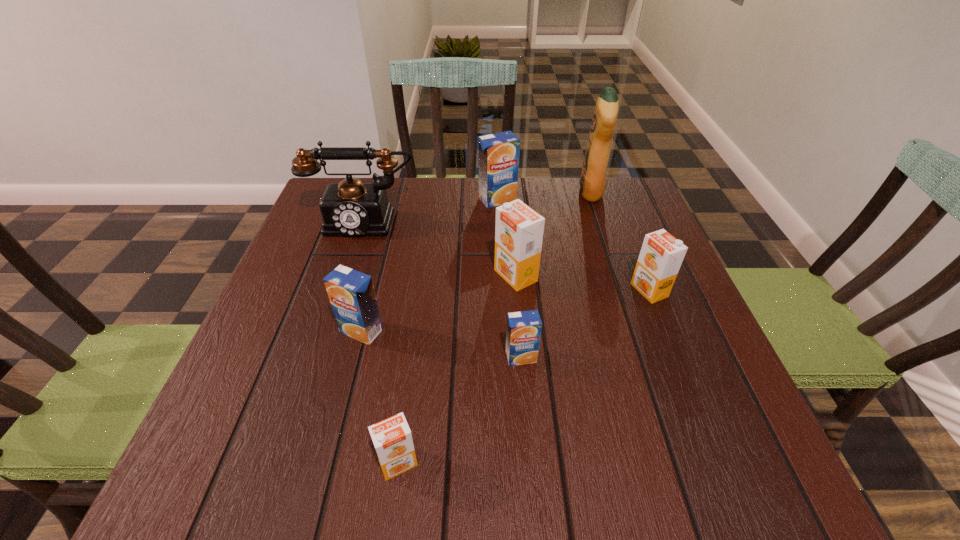
Select which orange juice is the sixth closest to the detergent. Please provide its 2D coordinates. Your answer should be formatted as a tuple, i.e. [(x, y)], where the tuple contains the x and y coordinates of a point satisfying the conditions above.

[(392, 438)]

Select which orange juice is the second closest to the rightmost orange orange juice. Please provide its 2D coordinates. Your answer should be formatted as a tuple, i.e. [(x, y)], where the tuple contains the x and y coordinates of a point satisfying the conditions above.

[(523, 333)]

Where is `the closest blue orange_juice relative to the fifth farthest orange juice`? the closest blue orange_juice relative to the fifth farthest orange juice is located at coordinates (351, 293).

This screenshot has height=540, width=960. What are the coordinates of `blue orange_juice object that ranks as the third closest to the nearest orange juice` in the screenshot? It's located at (498, 153).

Where is `orange orange juice object that ranks as the second closest to the rightmost orange juice`? This screenshot has height=540, width=960. orange orange juice object that ranks as the second closest to the rightmost orange juice is located at coordinates (392, 438).

Identify which orange orange juice is the second nearest to the gray telephone. Please provide its 2D coordinates. Your answer should be formatted as a tuple, i.e. [(x, y)], where the tuple contains the x and y coordinates of a point satisfying the conditions above.

[(661, 255)]

The height and width of the screenshot is (540, 960). What are the coordinates of `free space that satisfies the following two spatial constraints: 1. on the back side of the nearest blue orange_juice; 2. on the right side of the second orange orange juice from right to left` in the screenshot? It's located at (515, 276).

Find the location of a particular element. The width and height of the screenshot is (960, 540). free location that satisfies the following two spatial constraints: 1. on the front of the second orange orange juice from right to left at the rotary dial; 2. on the left side of the telephone is located at coordinates (346, 276).

The height and width of the screenshot is (540, 960). In order to click on vacant space that satisfies the following two spatial constraints: 1. on the back side of the nearest object; 2. on the right side of the second biggest orange orange juice in this screenshot , I will do `click(422, 291)`.

Locate an element on the screen. The image size is (960, 540). blank space that satisfies the following two spatial constraints: 1. on the front side of the farthest blue orange_juice; 2. on the left side of the nearest blue orange_juice is located at coordinates tap(506, 357).